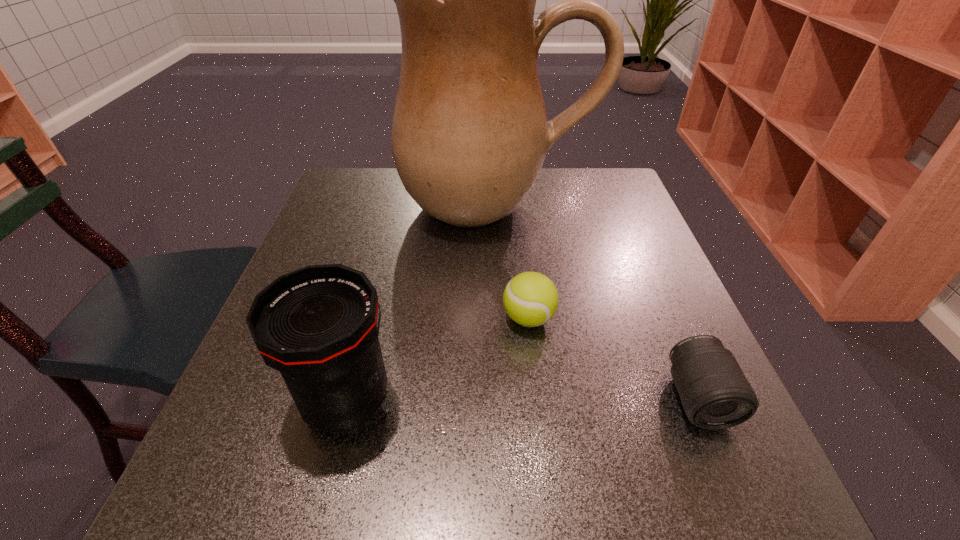
Where is `vacant area that lies between the cream pitcher and the second tallest object`? The image size is (960, 540). vacant area that lies between the cream pitcher and the second tallest object is located at coordinates coord(421,303).

This screenshot has height=540, width=960. In order to click on object identified as the closest to the cream pitcher in this screenshot , I will do `click(530, 299)`.

Find the location of `object that stands as the third closest to the shorter telephoto lens`. object that stands as the third closest to the shorter telephoto lens is located at coordinates (318, 326).